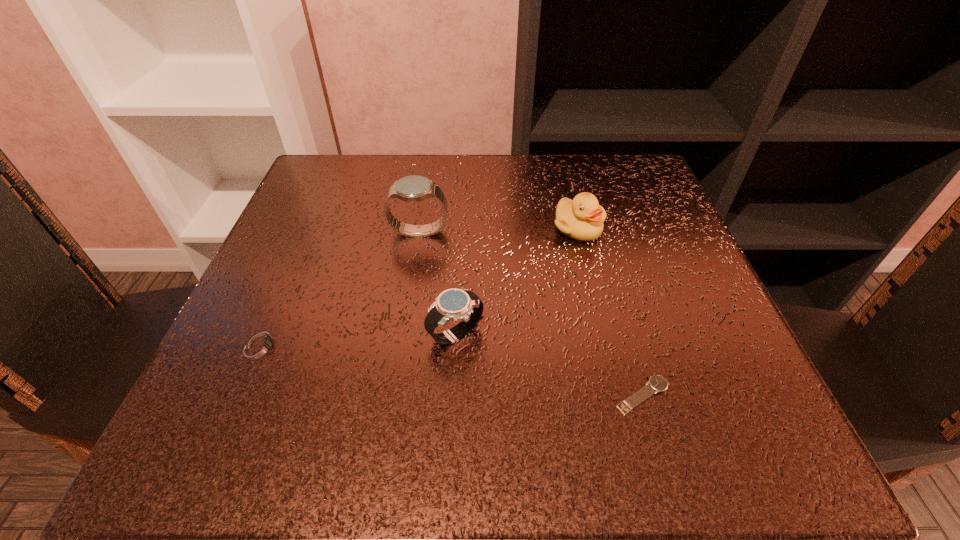
You are a GUI agent. You are given a task and a screenshot of the screen. Output one action in this format:
    pyautogui.click(x=<x>, y=<y>)
    Task: Click on the closest watch relative to the tallest watch
    The image size is (960, 540).
    Given the screenshot: What is the action you would take?
    pyautogui.click(x=462, y=305)

The width and height of the screenshot is (960, 540). In order to click on vacant space that satisfies the following two spatial constraints: 1. on the face of the nearest object; 2. on the left side of the second shortest object in this screenshot , I will do `click(240, 395)`.

The width and height of the screenshot is (960, 540). I want to click on vacant region that satisfies the following two spatial constraints: 1. on the face of the rightmost watch; 2. on the right side of the leftmost watch, so click(240, 395).

Locate an element on the screen. vacant region that satisfies the following two spatial constraints: 1. on the front side of the second tallest watch; 2. on the face of the leftmost object is located at coordinates (455, 346).

You are a GUI agent. You are given a task and a screenshot of the screen. Output one action in this format:
    pyautogui.click(x=<x>, y=<y>)
    Task: Click on the free space that satisfies the following two spatial constraints: 1. on the front-facing side of the duckling; 2. on the face of the leftmost object
    This screenshot has height=540, width=960.
    Given the screenshot: What is the action you would take?
    pyautogui.click(x=608, y=346)

Identify the location of free space in the image that satisfies the following two spatial constraints: 1. on the front-facing side of the duckling; 2. on the face of the second shortest watch. The image size is (960, 540). (608, 346).

This screenshot has height=540, width=960. I want to click on free region that satisfies the following two spatial constraints: 1. on the face of the leftmost watch; 2. on the right side of the nearest object, so click(x=240, y=395).

The width and height of the screenshot is (960, 540). I want to click on blank space that satisfies the following two spatial constraints: 1. on the front-facing side of the duckling; 2. on the face of the leftmost watch, so click(x=608, y=346).